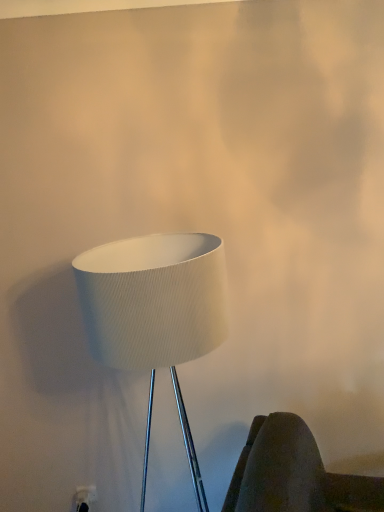
Image resolution: width=384 pixels, height=512 pixels. In order to click on white ribbed fabric lampshade at center in this screenshot , I will do `click(155, 313)`.

The height and width of the screenshot is (512, 384). Describe the element at coordinates (155, 313) in the screenshot. I see `white ribbed fabric lampshade at center` at that location.

You are a GUI agent. You are given a task and a screenshot of the screen. Output one action in this format:
    pyautogui.click(x=<x>, y=<y>)
    Task: Click on the white ribbed fabric lampshade at center
    The width and height of the screenshot is (384, 512).
    Given the screenshot: What is the action you would take?
    pyautogui.click(x=155, y=313)